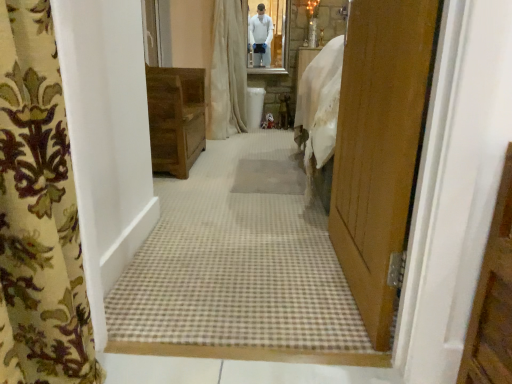
Question: Considering the relative sizes of beige fabric curtain at center, which is the second curtain in bottom-to-top order, and beige textured mat at center in the image provided, is beige fabric curtain at center, which is the second curtain in bottom-to-top order, smaller than beige textured mat at center?

Choices:
 (A) no
 (B) yes

Answer: (A)

Question: Considering the relative positions of beige fabric curtain at center, which appears as the second curtain when viewed from the front, and beige textured mat at center in the image provided, is beige fabric curtain at center, which appears as the second curtain when viewed from the front, to the left of beige textured mat at center from the viewer's perspective?

Choices:
 (A) yes
 (B) no

Answer: (A)

Question: Is beige fabric curtain at center, which appears as the second curtain when viewed from the front, thinner than beige textured mat at center?

Choices:
 (A) yes
 (B) no

Answer: (B)

Question: Is beige fabric curtain at center, which appears as the second curtain when viewed from the front, next to beige textured mat at center?

Choices:
 (A) yes
 (B) no

Answer: (B)

Question: Considering the relative sizes of beige fabric curtain at center, marked as the 1th curtain in a back-to-front arrangement, and beige textured mat at center in the image provided, is beige fabric curtain at center, marked as the 1th curtain in a back-to-front arrangement, bigger than beige textured mat at center?

Choices:
 (A) yes
 (B) no

Answer: (A)

Question: Is beige fabric curtain at center, marked as the 1th curtain in a back-to-front arrangement, closer to camera compared to beige textured mat at center?

Choices:
 (A) no
 (B) yes

Answer: (A)

Question: Is beige fabric curtain at center, which is the second curtain in bottom-to-top order, wider than beige carpet at center?

Choices:
 (A) yes
 (B) no

Answer: (B)

Question: From a real-world perspective, is beige fabric curtain at center, which ranks as the first curtain in top-to-bottom order, under beige carpet at center?

Choices:
 (A) yes
 (B) no

Answer: (B)

Question: From the image's perspective, is beige fabric curtain at center, which appears as the second curtain when viewed from the front, on top of beige carpet at center?

Choices:
 (A) no
 (B) yes

Answer: (B)

Question: From a real-world perspective, is beige fabric curtain at center, marked as the 1th curtain in a back-to-front arrangement, on beige carpet at center?

Choices:
 (A) yes
 (B) no

Answer: (A)

Question: Is beige fabric curtain at center, which is the second curtain in bottom-to-top order, to the left of beige carpet at center from the viewer's perspective?

Choices:
 (A) no
 (B) yes

Answer: (B)

Question: Is beige carpet at center inside beige fabric curtain at center, which is the second curtain in bottom-to-top order?

Choices:
 (A) yes
 (B) no

Answer: (B)

Question: From a real-world perspective, does wooden cabinet at center sit lower than wooden door at right?

Choices:
 (A) yes
 (B) no

Answer: (A)